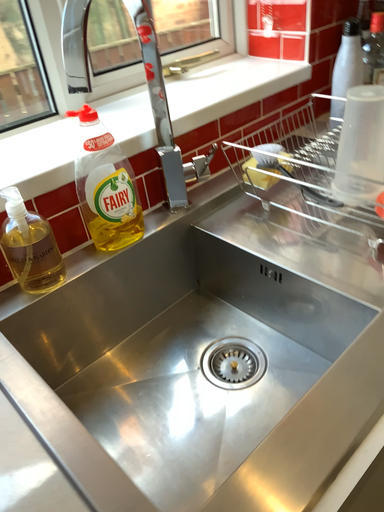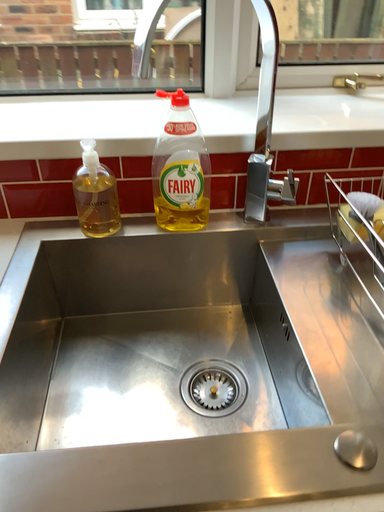
Question: How did the camera likely rotate when shooting the video?

Choices:
 (A) rotated left
 (B) rotated right

Answer: (A)